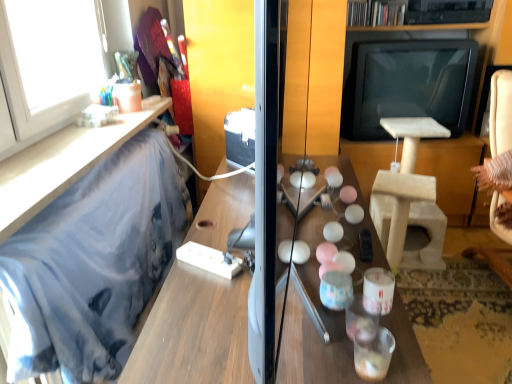
At what (x,y) coordinates should I click in order to perform the action: click on free space to the left of white glossy candle holder at center. Please return your answer as a coordinate pair (x, y). The width and height of the screenshot is (512, 384). Looking at the image, I should click on (318, 315).